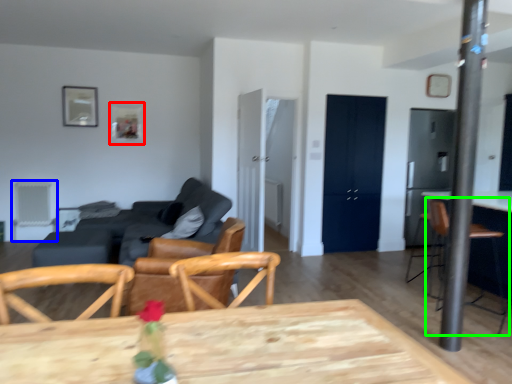
Question: Which is farther away from picture frame (highlighted by a red box)? armchair (highlighted by a blue box) or armchair (highlighted by a green box)?

Choices:
 (A) armchair
 (B) armchair

Answer: (B)